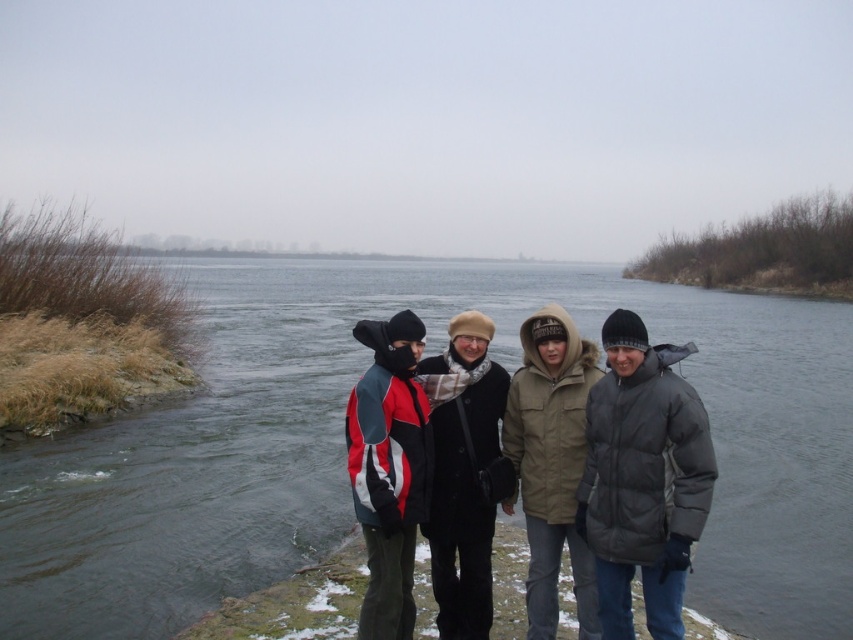
You are standing at the riverbank and want to walk towards the greenish water at center. The red and gray jacket at center is blocking your path. Can you walk around the jacket to reach the water?

The greenish water at center is in front of the red and gray jacket at center, meaning the jacket is between you and the water. To reach the water, you would need to move around the jacket either to the left or right side.

You are trying to decide which coat to choose based on the image. The khaki woolen coat at center and the black wool coat at center are both available. If you want a taller coat, which one should you pick?

The black wool coat at center is taller than the khaki woolen coat at center, so you should choose the black wool coat at center if you want a taller coat.